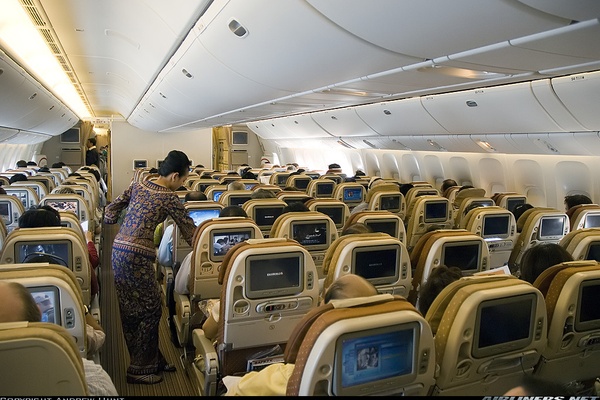
This screenshot has width=600, height=400. I want to click on blank or black tv screens, so click(x=498, y=324), click(x=584, y=298), click(x=447, y=256), click(x=377, y=267), click(x=291, y=270), click(x=430, y=207), click(x=496, y=225), click(x=545, y=224), click(x=588, y=224).